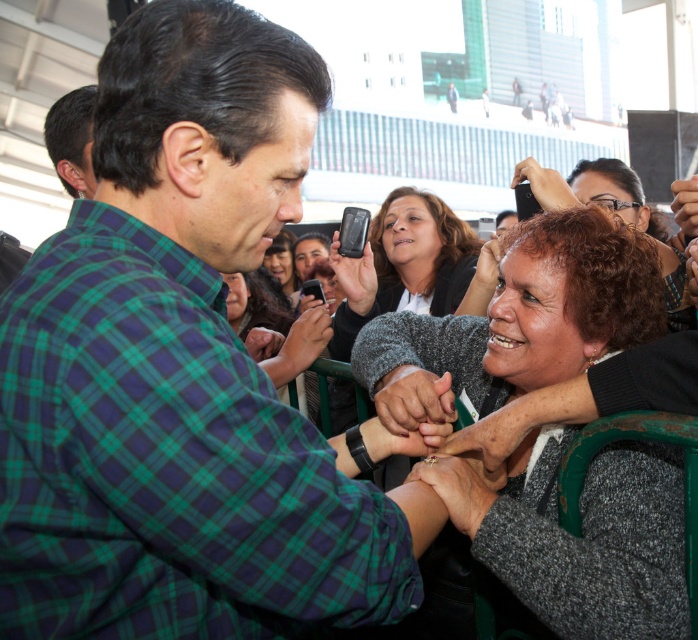
Question: Among these objects, which one is farthest from the camera?

Choices:
 (A) green plaid shirt at center
 (B) black matte phone at upper right
 (C) matte black phone at center

Answer: (C)

Question: Which point is farther from the camera taking this photo?

Choices:
 (A) (371, 252)
 (B) (272, 253)

Answer: (B)

Question: Which point is closer to the camera taking this photo?

Choices:
 (A) (600, 572)
 (B) (77, 157)
 (C) (297, 328)
 (D) (98, 504)

Answer: (D)

Question: Does green plaid shirt at center appear under green plaid shirt at upper left?

Choices:
 (A) yes
 (B) no

Answer: (A)

Question: Can you confirm if green plaid shirt at center is positioned to the left of matte black phone at center?

Choices:
 (A) no
 (B) yes

Answer: (B)

Question: Does green plaid shirt at upper left have a larger size compared to matte black phone at center?

Choices:
 (A) yes
 (B) no

Answer: (A)